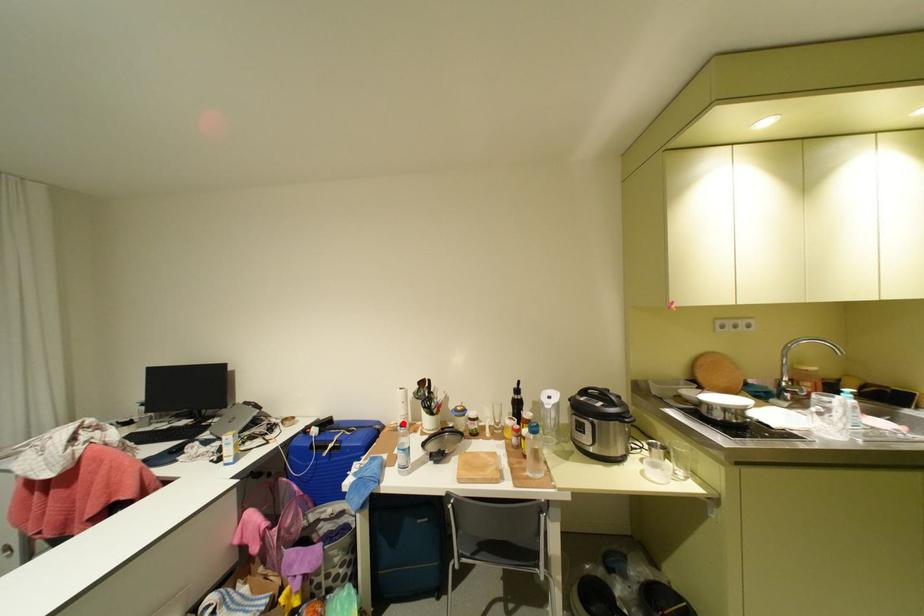
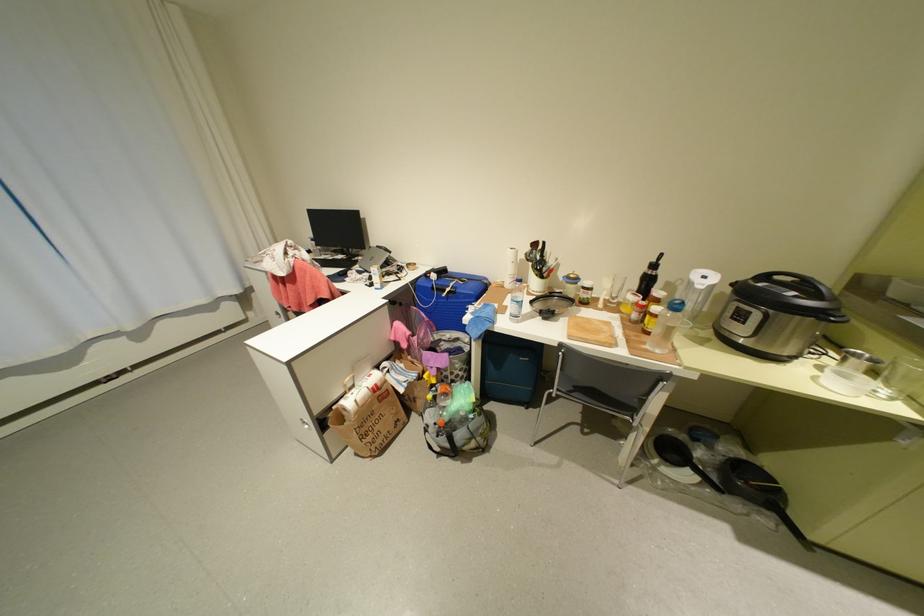
Question: I am providing you with two images of the same scene from different viewpoints. Given a red point in image1, look at the same physical point in image2. Is it:

Choices:
 (A) Closer to the viewpoint
 (B) Farther from the viewpoint

Answer: (A)